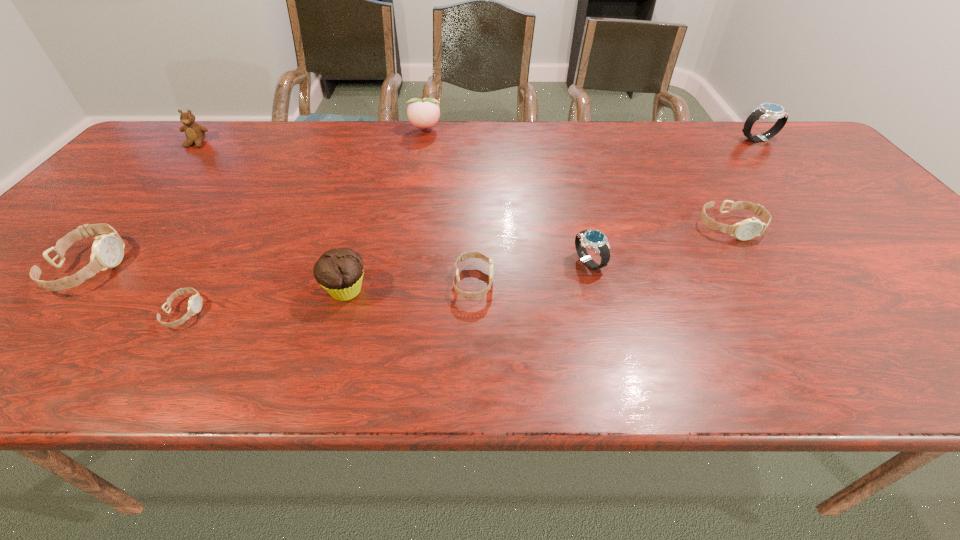
The height and width of the screenshot is (540, 960). I want to click on watch located at the left edge, so click(x=107, y=250).

Where is `object that is at the right edge`? object that is at the right edge is located at coordinates (766, 110).

This screenshot has width=960, height=540. In order to click on object that is at the far left corner in this screenshot , I will do `click(195, 134)`.

The image size is (960, 540). Find the location of `object that is positioned at the far right corner`. object that is positioned at the far right corner is located at coordinates click(x=766, y=110).

I want to click on vacant space at the far edge, so click(428, 156).

The height and width of the screenshot is (540, 960). In the image, there is a desktop. Find the location of `free space at the near edge`. free space at the near edge is located at coordinates (428, 379).

The width and height of the screenshot is (960, 540). I want to click on free space at the left edge of the desktop, so click(x=125, y=210).

Locate an element on the screen. The width and height of the screenshot is (960, 540). vacant area at the right edge of the desktop is located at coordinates (846, 186).

Locate an element on the screen. The height and width of the screenshot is (540, 960). vacant space at the far left corner of the desktop is located at coordinates [x=184, y=135].

The width and height of the screenshot is (960, 540). Find the location of `free point between the teddy bear and the fifth watch from left to right`. free point between the teddy bear and the fifth watch from left to right is located at coordinates tap(464, 185).